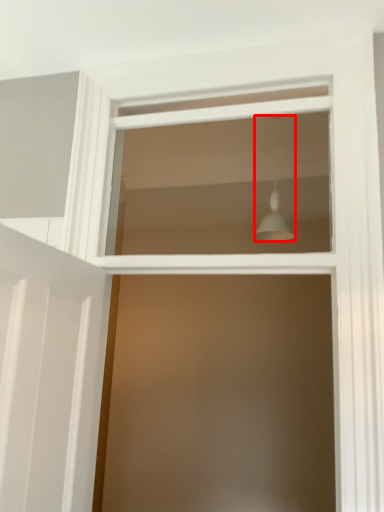
Question: Where is light fixture (annotated by the red box) located in relation to window in the image?

Choices:
 (A) right
 (B) left

Answer: (A)